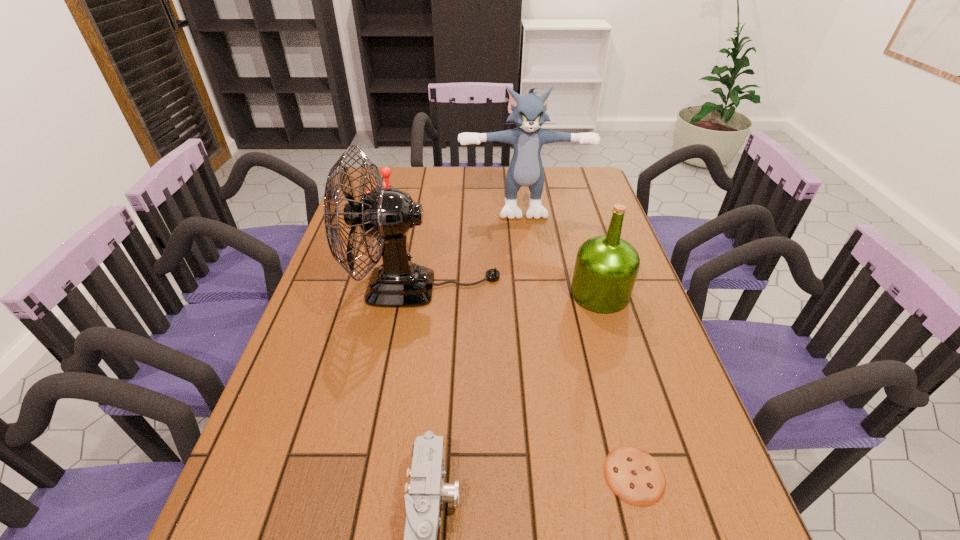
This screenshot has width=960, height=540. In order to click on cat in this screenshot , I will do `click(529, 112)`.

I want to click on fan, so click(x=387, y=215).

At what (x,y) coordinates should I click in order to perform the action: click on the third tallest object. Please return your answer as a coordinate pair (x, y). Looking at the image, I should click on (606, 267).

Locate an element on the screen. the third shortest object is located at coordinates (385, 171).

I want to click on cookie, so click(x=632, y=474).

Locate an element on the screen. free space located on the front-facing side of the cat is located at coordinates (535, 295).

Find the location of a particular element. free space located in front of the fan, indicating the direction of air flow is located at coordinates (602, 288).

This screenshot has height=540, width=960. I want to click on vacant area located on the back of the third tallest object, so click(x=579, y=225).

In order to click on vacant space positioned 0.150m on the front of the fourth tallest object in this screenshot , I will do `click(375, 251)`.

The height and width of the screenshot is (540, 960). What are the coordinates of `vacant area located 0.160m on the back of the cookie` in the screenshot? It's located at (610, 381).